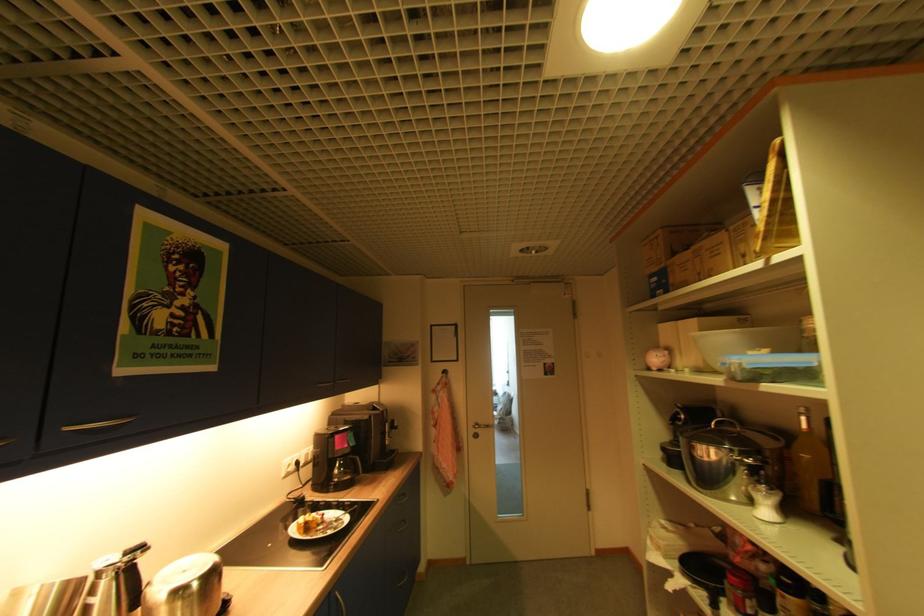
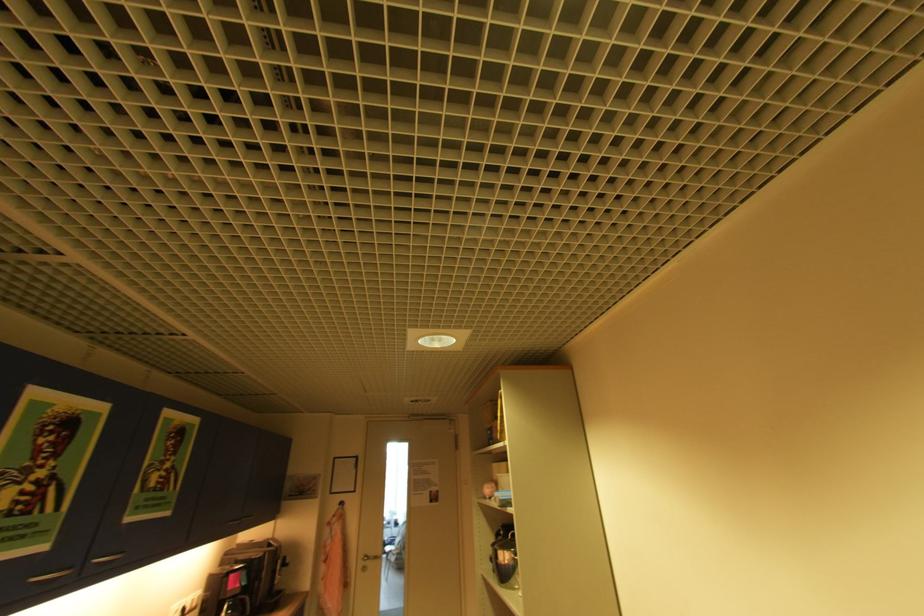
Question: Which direction would the cameraman need to move to produce the second image? Reply with the corresponding letter.

Choices:
 (A) Left
 (B) Right
 (C) Forward
 (D) Backward

Answer: (D)